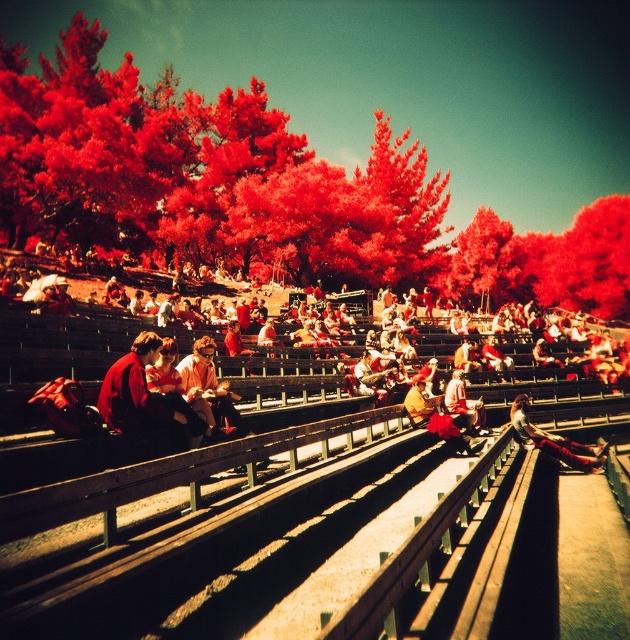
Between matte pink hoodie at center and matte red jacket at center, which one has more height?

With more height is matte pink hoodie at center.

Who is more forward, (212,369) or (469,412)?

Point (212,369) is more forward.

In order to click on matte pink hoodie at center in this screenshot , I will do `click(209, 387)`.

Does point (135, 374) lie behind point (454, 374)?

No, it is in front of (454, 374).

Does matte red jacket at left appear on the left side of matte red jacket at center?

Yes, matte red jacket at left is to the left of matte red jacket at center.

Locate an element on the screen. Image resolution: width=630 pixels, height=640 pixels. matte red jacket at left is located at coordinates click(x=146, y=397).

Is red textured trees at upper left above red matte tree at upper right?

Yes, red textured trees at upper left is above red matte tree at upper right.

Based on the photo, who is positioned more to the left, red textured trees at upper left or red matte tree at upper right?

From the viewer's perspective, red textured trees at upper left appears more on the left side.

What do you see at coordinates (203, 173) in the screenshot? I see `red textured trees at upper left` at bounding box center [203, 173].

At what (x,y) coordinates should I click in order to perform the action: click on red textured trees at upper left. Please return your answer as a coordinate pair (x, y). Looking at the image, I should click on (203, 173).